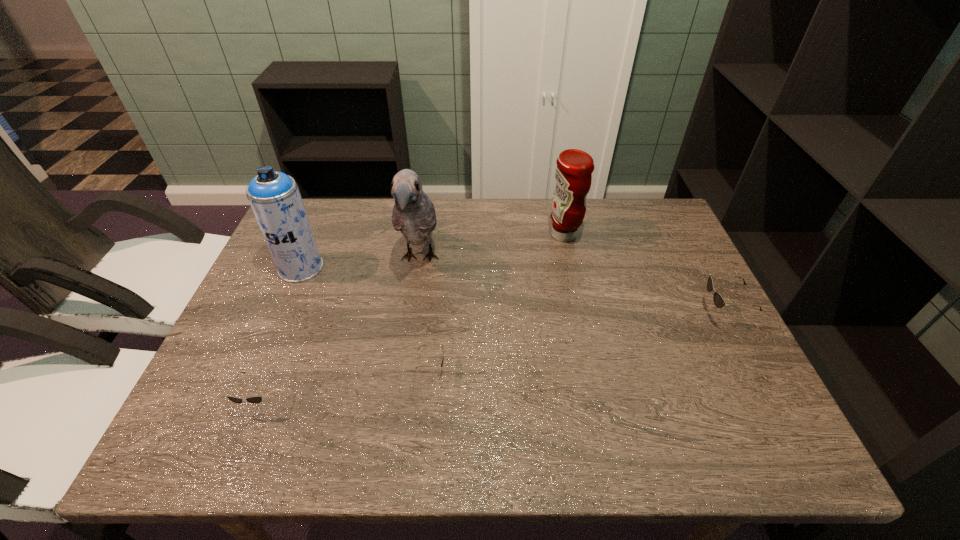
I want to click on aerosol can present at the left edge, so click(275, 199).

The height and width of the screenshot is (540, 960). In order to click on object present at the right edge in this screenshot , I will do `click(719, 301)`.

Where is `object at the near left corner`? object at the near left corner is located at coordinates (253, 399).

You are a GUI agent. You are given a task and a screenshot of the screen. Output one action in this format:
    pyautogui.click(x=<x>, y=<y>)
    Task: Click on the vacant area at the far edge of the desktop
    This screenshot has height=540, width=960.
    Given the screenshot: What is the action you would take?
    pyautogui.click(x=444, y=215)

The width and height of the screenshot is (960, 540). I want to click on free space at the near edge of the desktop, so click(x=512, y=399).

The image size is (960, 540). Find the location of `vacant space at the left edge of the desktop`. vacant space at the left edge of the desktop is located at coordinates (234, 335).

This screenshot has width=960, height=540. I want to click on free space at the right edge, so click(678, 317).

The width and height of the screenshot is (960, 540). I want to click on free space at the far left corner, so click(x=323, y=207).

At what (x,y) coordinates should I click in order to perform the action: click on free space at the near left corner of the desktop. Please return your answer as a coordinate pair (x, y). This screenshot has height=540, width=960. Looking at the image, I should click on (211, 381).

The height and width of the screenshot is (540, 960). What are the coordinates of `vacant space at the far right corner of the desktop` in the screenshot? It's located at (626, 222).